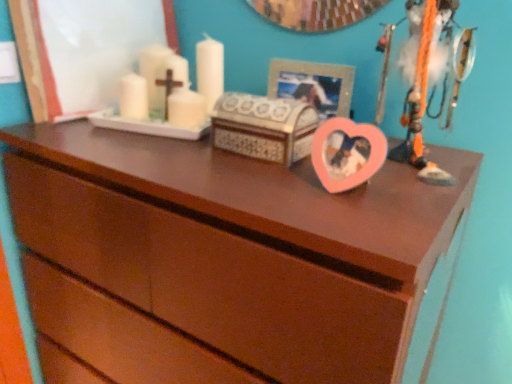
Where is `free space in front of pink plastic heart at upper right`? This screenshot has height=384, width=512. free space in front of pink plastic heart at upper right is located at coordinates click(399, 195).